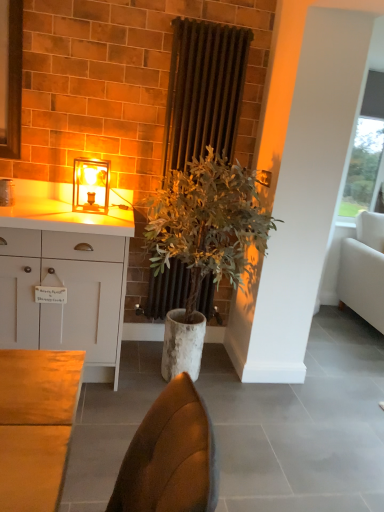
Question: Should I look upward or downward to see dark brown radiator at center?

Choices:
 (A) down
 (B) up

Answer: (B)

Question: From the image's perspective, does white fabric couch at right appear higher than dark brown radiator at center?

Choices:
 (A) yes
 (B) no

Answer: (B)

Question: Can you confirm if white fabric couch at right is thinner than dark brown radiator at center?

Choices:
 (A) no
 (B) yes

Answer: (A)

Question: From the image's perspective, is white fabric couch at right under dark brown radiator at center?

Choices:
 (A) yes
 (B) no

Answer: (A)

Question: Is white fabric couch at right smaller than dark brown radiator at center?

Choices:
 (A) no
 (B) yes

Answer: (A)

Question: Are white fabric couch at right and dark brown radiator at center making contact?

Choices:
 (A) yes
 (B) no

Answer: (B)

Question: Considering the relative positions of white fabric couch at right and dark brown radiator at center in the image provided, is white fabric couch at right to the left of dark brown radiator at center from the viewer's perspective?

Choices:
 (A) yes
 (B) no

Answer: (B)

Question: Could you tell me if white matte cabinet at left is turned towards dark brown radiator at center?

Choices:
 (A) no
 (B) yes

Answer: (A)

Question: Does white matte cabinet at left come behind dark brown radiator at center?

Choices:
 (A) no
 (B) yes

Answer: (A)

Question: From the image's perspective, is white matte cabinet at left beneath dark brown radiator at center?

Choices:
 (A) no
 (B) yes

Answer: (B)

Question: Is white matte cabinet at left outside of dark brown radiator at center?

Choices:
 (A) yes
 (B) no

Answer: (A)

Question: Considering the relative sizes of white matte cabinet at left and dark brown radiator at center in the image provided, is white matte cabinet at left thinner than dark brown radiator at center?

Choices:
 (A) yes
 (B) no

Answer: (B)

Question: Is dark brown radiator at center at the back of white matte cabinet at left?

Choices:
 (A) no
 (B) yes

Answer: (A)

Question: Is the depth of white fabric couch at right less than that of white matte cabinet at left?

Choices:
 (A) yes
 (B) no

Answer: (B)